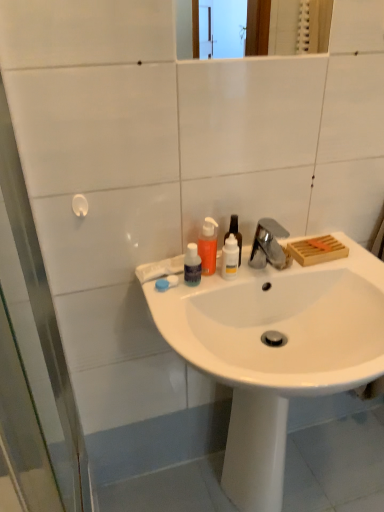
What is the approximate height of satin nickel faucet at upper center?

satin nickel faucet at upper center is 1.85 inches in height.

Locate an element on the screen. The height and width of the screenshot is (512, 384). transparent plastic bottle at center, placed as the 1th bottle when sorted from right to left is located at coordinates (235, 234).

What is the approximate height of translucent orange liquid at sink center, the 2th bottle in the left-to-right sequence?

The height of translucent orange liquid at sink center, the 2th bottle in the left-to-right sequence, is 5.96 inches.

This screenshot has height=512, width=384. I want to click on translucent orange liquid at sink center, acting as the third bottle starting from the right, so click(x=208, y=247).

The height and width of the screenshot is (512, 384). Identify the location of white glossy sink at center. 276,351.

You are a GUI agent. You are given a task and a screenshot of the screen. Output one action in this format:
    pyautogui.click(x=<x>, y=<y>)
    Task: Click on the white plastic hook at left
    This screenshot has width=384, height=512.
    Given the screenshot: What is the action you would take?
    pyautogui.click(x=33, y=358)

Would you consider satin nickel faucet at upper center to be distant from transparent plastic bottle at center, placed as the 1th bottle when sorted from right to left?

Actually, satin nickel faucet at upper center and transparent plastic bottle at center, placed as the 1th bottle when sorted from right to left, are a little close together.

In the image, is satin nickel faucet at upper center on the left side or the right side of transparent plastic bottle at center, placed as the 1th bottle when sorted from right to left?

Clearly, satin nickel faucet at upper center is on the right of transparent plastic bottle at center, placed as the 1th bottle when sorted from right to left, in the image.

Can you confirm if satin nickel faucet at upper center is wider than transparent plastic bottle at center, the fourth bottle positioned from the left?

Indeed, satin nickel faucet at upper center has a greater width compared to transparent plastic bottle at center, the fourth bottle positioned from the left.

Which of these two, satin nickel faucet at upper center or transparent plastic bottle at center, placed as the 1th bottle when sorted from right to left, is smaller?

satin nickel faucet at upper center is smaller.

Do you think translucent plastic bottle at center, acting as the 3th bottle starting from the left, is within transparent plastic bottle at center, which is the fourth bottle in right-to-left order, or outside of it?

translucent plastic bottle at center, acting as the 3th bottle starting from the left, cannot be found inside transparent plastic bottle at center, which is the fourth bottle in right-to-left order.

Where is `the 2nd bottle counting from the right side of the transparent plastic bottle at center, arranged as the 1th bottle when viewed from the left`? Image resolution: width=384 pixels, height=512 pixels. the 2nd bottle counting from the right side of the transparent plastic bottle at center, arranged as the 1th bottle when viewed from the left is located at coordinates (230, 258).

Which of these two, translucent plastic bottle at center, acting as the 3th bottle starting from the left, or transparent plastic bottle at center, arranged as the 1th bottle when viewed from the left, stands taller?

translucent plastic bottle at center, acting as the 3th bottle starting from the left, is taller.

Does white glossy sink at center lie in front of white plastic hook at left?

No, it is not.

Is point (270, 439) more distant than point (11, 189)?

Yes, point (270, 439) is farther from viewer.

From the picture: How many degrees apart are the facing directions of white glossy sink at center and white plastic hook at left?

white glossy sink at center and white plastic hook at left are facing 89.8 degrees away from each other.

From a real-world perspective, is transparent plastic bottle at center, arranged as the 1th bottle when viewed from the left, positioned over transparent plastic bottle at center, the fourth bottle positioned from the left, based on gravity?

Actually, transparent plastic bottle at center, arranged as the 1th bottle when viewed from the left, is physically below transparent plastic bottle at center, the fourth bottle positioned from the left, in the real world.

Considering the positions of points (191, 285) and (238, 232), is point (191, 285) closer to camera compared to point (238, 232)?

Yes, it is in front of point (238, 232).

How many degrees apart are the facing directions of transparent plastic bottle at center, arranged as the 1th bottle when viewed from the left, and transparent plastic bottle at center, the fourth bottle positioned from the left?

They differ by 0.000588 degrees in their facing directions.

Is transparent plastic bottle at center, which is the fourth bottle in right-to-left order, positioned far away from transparent plastic bottle at center, placed as the 1th bottle when sorted from right to left?

No.

Is transparent plastic bottle at center, placed as the 1th bottle when sorted from right to left, looking in the opposite direction of white glossy sink at center?

No, transparent plastic bottle at center, placed as the 1th bottle when sorted from right to left,'s orientation is not away from white glossy sink at center.

Consider the image. How many degrees apart are the facing directions of transparent plastic bottle at center, the fourth bottle positioned from the left, and white glossy sink at center?

7.24 degrees separate the facing orientations of transparent plastic bottle at center, the fourth bottle positioned from the left, and white glossy sink at center.

From their relative heights in the image, would you say transparent plastic bottle at center, the fourth bottle positioned from the left, is taller or shorter than white glossy sink at center?

Considering their sizes, transparent plastic bottle at center, the fourth bottle positioned from the left, has less height than white glossy sink at center.

Is transparent plastic bottle at center, placed as the 1th bottle when sorted from right to left, placed right next to white glossy sink at center?

No.

Does white glossy sink at center appear on the right side of satin nickel faucet at upper center?

Correct, you'll find white glossy sink at center to the right of satin nickel faucet at upper center.

From the picture: Considering their positions, is white glossy sink at center located in front of or behind satin nickel faucet at upper center?

Visually, white glossy sink at center is located in front of satin nickel faucet at upper center.

Is point (335, 362) more distant than point (258, 225)?

That is False.

Do you think white glossy sink at center is within satin nickel faucet at upper center, or outside of it?

white glossy sink at center is outside satin nickel faucet at upper center.

Would you say white glossy sink at center is inside or outside transparent plastic bottle at center, arranged as the 1th bottle when viewed from the left?

The correct answer is: outside.

Is white glossy sink at center taller than transparent plastic bottle at center, which is the fourth bottle in right-to-left order?

Indeed, white glossy sink at center has a greater height compared to transparent plastic bottle at center, which is the fourth bottle in right-to-left order.

Relative to transparent plastic bottle at center, which is the fourth bottle in right-to-left order, is white glossy sink at center in front or behind?

white glossy sink at center is positioned closer to the viewer than transparent plastic bottle at center, which is the fourth bottle in right-to-left order.

From the picture: Does white glossy sink at center turn towards transparent plastic bottle at center, which is the fourth bottle in right-to-left order?

No, white glossy sink at center is not turned towards transparent plastic bottle at center, which is the fourth bottle in right-to-left order.

Where is `tap that appears below the transparent plastic bottle at center, the fourth bottle positioned from the left (from the image's perspective)`? tap that appears below the transparent plastic bottle at center, the fourth bottle positioned from the left (from the image's perspective) is located at coordinates (268, 245).

From a real-world perspective, starting from the transparent plastic bottle at center, arranged as the 1th bottle when viewed from the left, which bottle is the 1st one vertically above it? Please provide its 2D coordinates.

[(230, 258)]

From the image, which object appears to be nearer to translucent orange liquid at sink center, acting as the third bottle starting from the right, transparent plastic bottle at center, which is the fourth bottle in right-to-left order, or translucent plastic bottle at center, which is the 2th bottle from right to left?

transparent plastic bottle at center, which is the fourth bottle in right-to-left order, is closer to translucent orange liquid at sink center, acting as the third bottle starting from the right.

Looking at the image, which one is located further to transparent plastic bottle at center, arranged as the 1th bottle when viewed from the left, transparent plastic bottle at center, placed as the 1th bottle when sorted from right to left, or white glossy sink at center?

white glossy sink at center lies further to transparent plastic bottle at center, arranged as the 1th bottle when viewed from the left, than the other object.

Looking at the image, which one is located closer to white glossy sink at center, transparent plastic bottle at center, arranged as the 1th bottle when viewed from the left, or white plastic hook at left?

transparent plastic bottle at center, arranged as the 1th bottle when viewed from the left, is closer to white glossy sink at center.

Looking at the image, which one is located closer to transparent plastic bottle at center, placed as the 1th bottle when sorted from right to left, translucent plastic bottle at center, which is the 2th bottle from right to left, or transparent plastic bottle at center, which is the fourth bottle in right-to-left order?

Among the two, translucent plastic bottle at center, which is the 2th bottle from right to left, is located nearer to transparent plastic bottle at center, placed as the 1th bottle when sorted from right to left.

From the image, which object appears to be nearer to white glossy sink at center, translucent orange liquid at sink center, the 2th bottle in the left-to-right sequence, or white plastic hook at left?

The object closer to white glossy sink at center is translucent orange liquid at sink center, the 2th bottle in the left-to-right sequence.

Estimate the real-world distances between objects in this image. Which object is closer to satin nickel faucet at upper center, translucent orange liquid at sink center, the 2th bottle in the left-to-right sequence, or transparent plastic bottle at center, arranged as the 1th bottle when viewed from the left?

translucent orange liquid at sink center, the 2th bottle in the left-to-right sequence, lies closer to satin nickel faucet at upper center than the other object.

Looking at the image, which one is located further to transparent plastic bottle at center, which is the fourth bottle in right-to-left order, satin nickel faucet at upper center or white plastic hook at left?

Based on the image, white plastic hook at left appears to be further to transparent plastic bottle at center, which is the fourth bottle in right-to-left order.

Estimate the real-world distances between objects in this image. Which object is closer to translucent plastic bottle at center, which is the 2th bottle from right to left, transparent plastic bottle at center, placed as the 1th bottle when sorted from right to left, or transparent plastic bottle at center, arranged as the 1th bottle when viewed from the left?

Among the two, transparent plastic bottle at center, placed as the 1th bottle when sorted from right to left, is located nearer to translucent plastic bottle at center, which is the 2th bottle from right to left.

Identify the location of bottle located between translucent plastic bottle at center, which is the 2th bottle from right to left, and satin nickel faucet at upper center in the left-right direction. (235, 234).

Where is `sink positioned between white plastic hook at left and transparent plastic bottle at center, placed as the 1th bottle when sorted from right to left, from near to far`? The height and width of the screenshot is (512, 384). sink positioned between white plastic hook at left and transparent plastic bottle at center, placed as the 1th bottle when sorted from right to left, from near to far is located at coordinates [x=276, y=351].

At what (x,y) coordinates should I click in order to perform the action: click on sink located between white plastic hook at left and translucent orange liquid at sink center, acting as the third bottle starting from the right, in the depth direction. Please return your answer as a coordinate pair (x, y). The image size is (384, 512). Looking at the image, I should click on (276, 351).

Where is `bottle between white glossy sink at center and translucent plastic bottle at center, which is the 2th bottle from right to left, from front to back`? bottle between white glossy sink at center and translucent plastic bottle at center, which is the 2th bottle from right to left, from front to back is located at coordinates (192, 266).